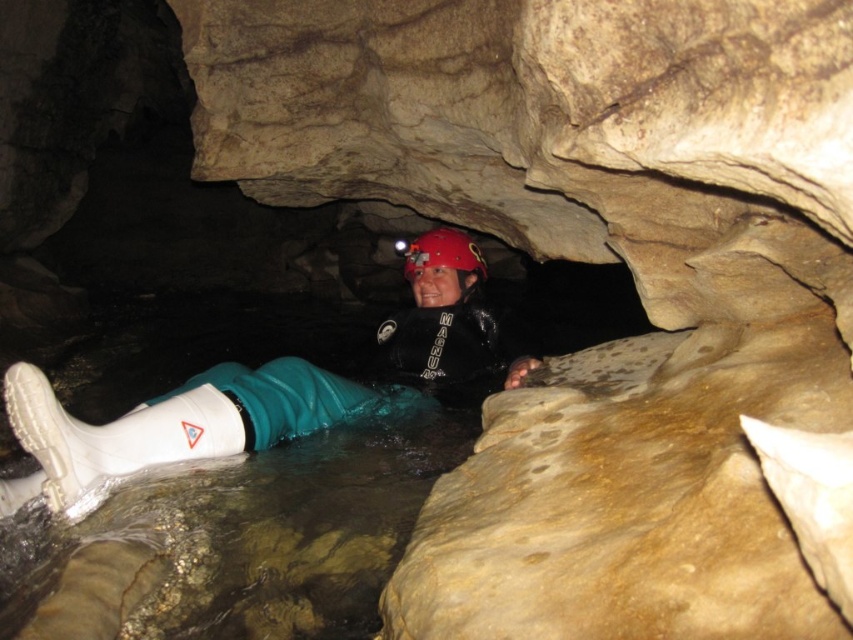
Which is in front, point (276, 397) or point (451, 253)?

Positioned in front is point (276, 397).

Who is positioned more to the right, white rubber boot at lower left or red matte helmet at center?

From the viewer's perspective, red matte helmet at center appears more on the right side.

Where is `white rubber boot at lower left`? This screenshot has width=853, height=640. white rubber boot at lower left is located at coordinates (171, 422).